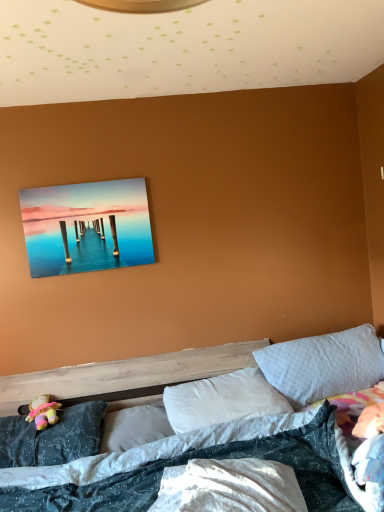
Question: In terms of width, does dark blue fabric pillow at lower left, which is the fourth pillow in right-to-left order, look wider or thinner when compared to white soft pillow at center, acting as the second pillow starting from the right?

Choices:
 (A) wide
 (B) thin

Answer: (A)

Question: From a real-world perspective, is dark blue fabric pillow at lower left, which is the fourth pillow in right-to-left order, positioned above or below white soft pillow at center, arranged as the 3th pillow when viewed from the left?

Choices:
 (A) above
 (B) below

Answer: (B)

Question: Estimate the real-world distances between objects in this image. Which object is closer to the white soft pillow at center, the second pillow in the left-to-right sequence?

Choices:
 (A) white soft pillow at upper right, positioned as the 1th pillow in right-to-left order
 (B) dark blue fabric pillow at lower left, which is counted as the first pillow, starting from the left
 (C) metallic glossy painting at upper center
 (D) white soft pillow at center, arranged as the 3th pillow when viewed from the left

Answer: (B)

Question: Estimate the real-world distances between objects in this image. Which object is closer to the dark blue fabric pillow at lower left, which is the fourth pillow in right-to-left order?

Choices:
 (A) white soft pillow at upper right, the 4th pillow viewed from the left
 (B) metallic glossy painting at upper center
 (C) white soft pillow at center, arranged as the 3th pillow when viewed from the left
 (D) white soft pillow at center, placed as the third pillow when sorted from right to left

Answer: (D)